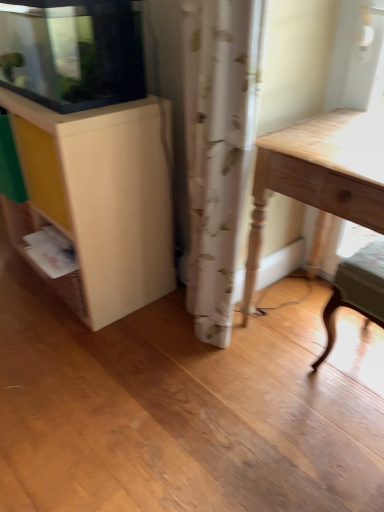
Locate an element on the screen. The width and height of the screenshot is (384, 512). unoccupied space behind wooden chair at lower right is located at coordinates (313, 306).